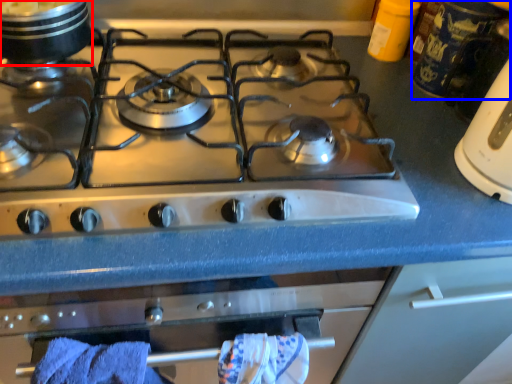
Question: Which of the following is the farthest to the observer, kitchen appliance (highlighted by a red box) or appliance (highlighted by a blue box)?

Choices:
 (A) kitchen appliance
 (B) appliance

Answer: (B)